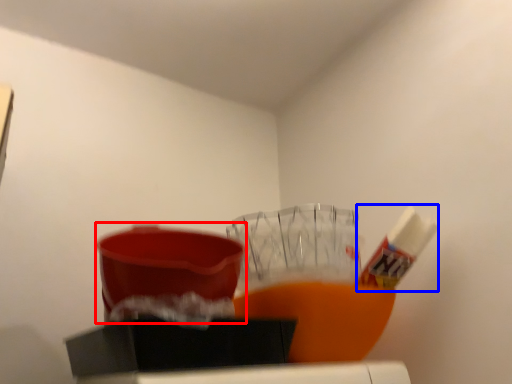
Question: Which object appears closest to the camera in this image, basin (highlighted by a red box) or toothpaste (highlighted by a blue box)?

Choices:
 (A) basin
 (B) toothpaste

Answer: (A)